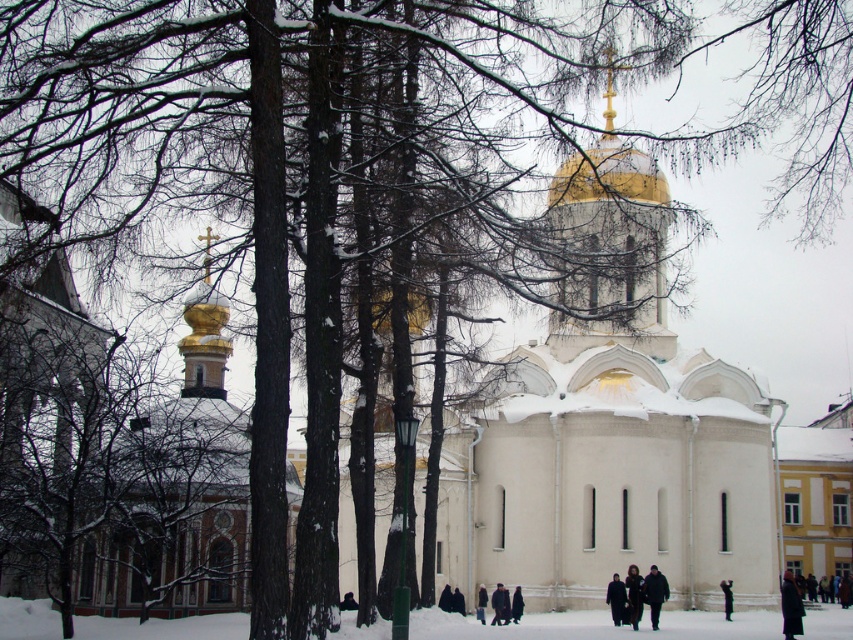
You are standing at the entrance of the church and notice the gold polished dome at upper center and the black fabric person at lower right. Which object appears bigger in the scene?

The gold polished dome at upper center appears bigger than the black fabric person at lower right in the scene.

You are a photographer standing at the edge of the snow, wanting to capture both the dark wool coat at center and the dark brown fur coat at lower center in a single photo. Given that your camera has a maximum focus range of 30 feet, will you be able to include both subjects in the photo without moving closer?

The dark wool coat at center and dark brown fur coat at lower center are 31.99 feet apart from each other. Since the distance between them exceeds the camera maximum focus range of 30 feet, you won wait be able to capture both in the same photo without moving closer.

You are a photographer standing at the edge of the snow bank, looking towards the church. You notice two coats at lower center. Which coat is closer to the church, the dark gray fabric coat at lower center or the dark brown fur coat at lower center?

The dark gray fabric coat at lower center is above the dark brown fur coat at lower center, meaning it is closer to the church since it is positioned higher in the image.